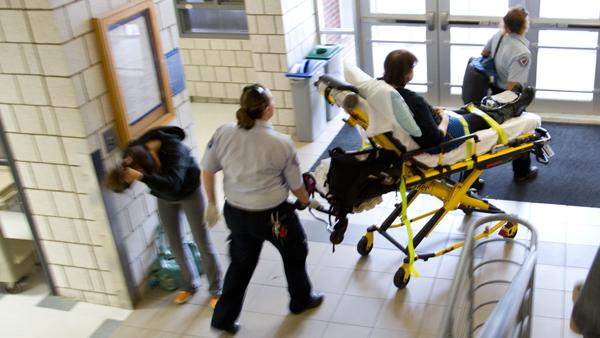
Identify the location of floor. The width and height of the screenshot is (600, 338). (550, 286).